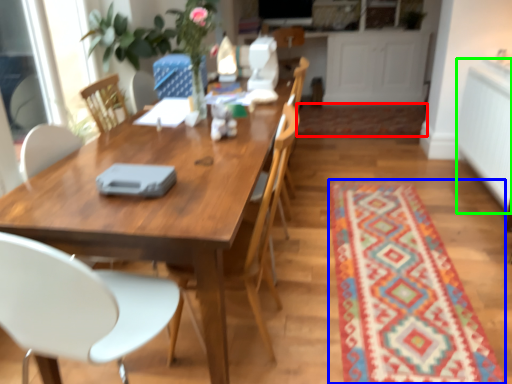
Question: Based on their relative distances, which object is farther from mat (highlighted by a red box)? Choose from mat (highlighted by a blue box) and counter top (highlighted by a green box).

Choices:
 (A) mat
 (B) counter top

Answer: (A)